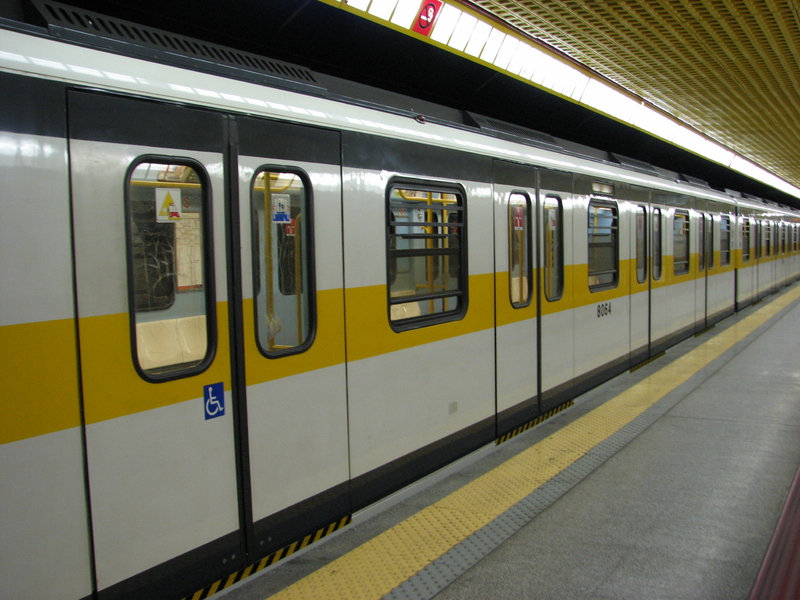
Find the location of a particular element. This screenshot has height=600, width=800. window is located at coordinates (180, 203).